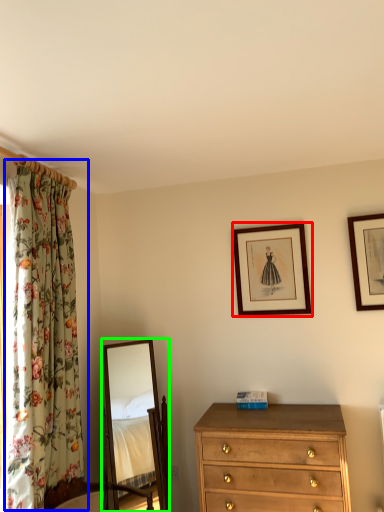
Question: Based on their relative distances, which object is farther from picture frame (highlighted by a red box)? Choose from curtain (highlighted by a blue box) and mirror (highlighted by a green box).

Choices:
 (A) curtain
 (B) mirror

Answer: (B)